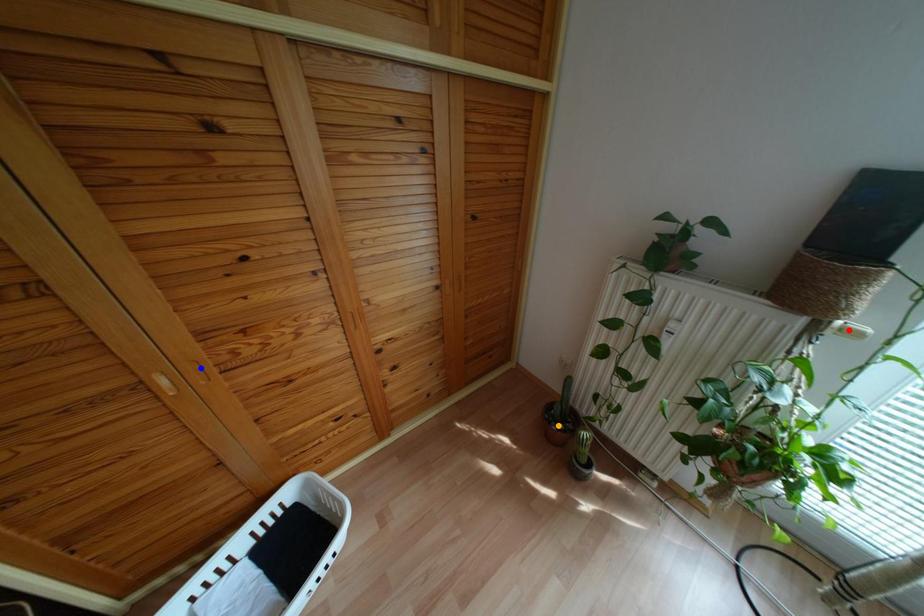
Order these from nearest to farthest:
orange point
blue point
red point

red point → blue point → orange point